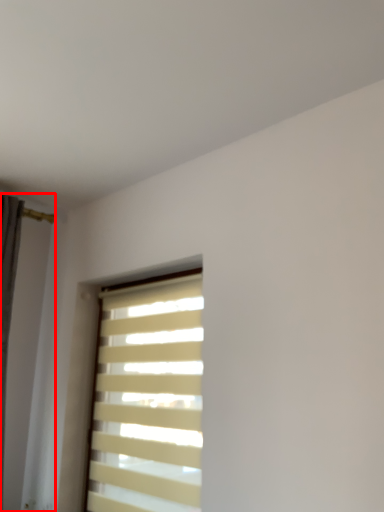
Question: From the image's perspective, what is the correct spatial positioning of shutter (annotated by the red box) in reference to window blind?

Choices:
 (A) below
 (B) above

Answer: (B)